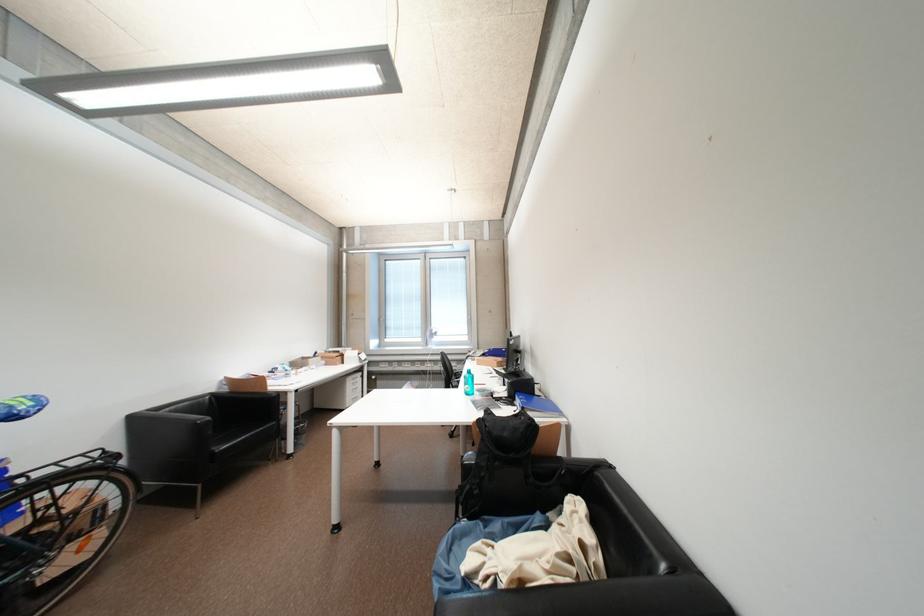
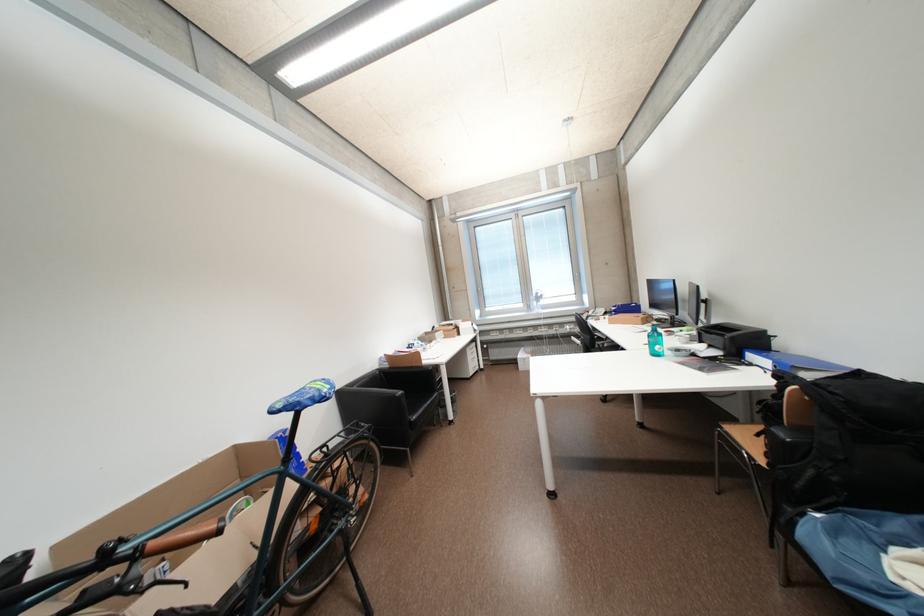
In the second image, find the point that corresponds to point (50, 408) in the first image.

(341, 390)